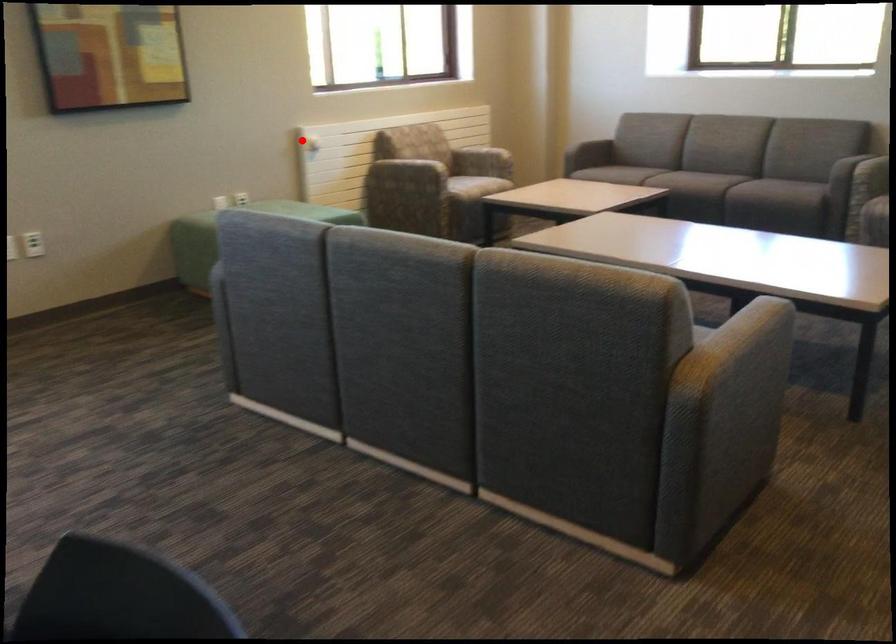
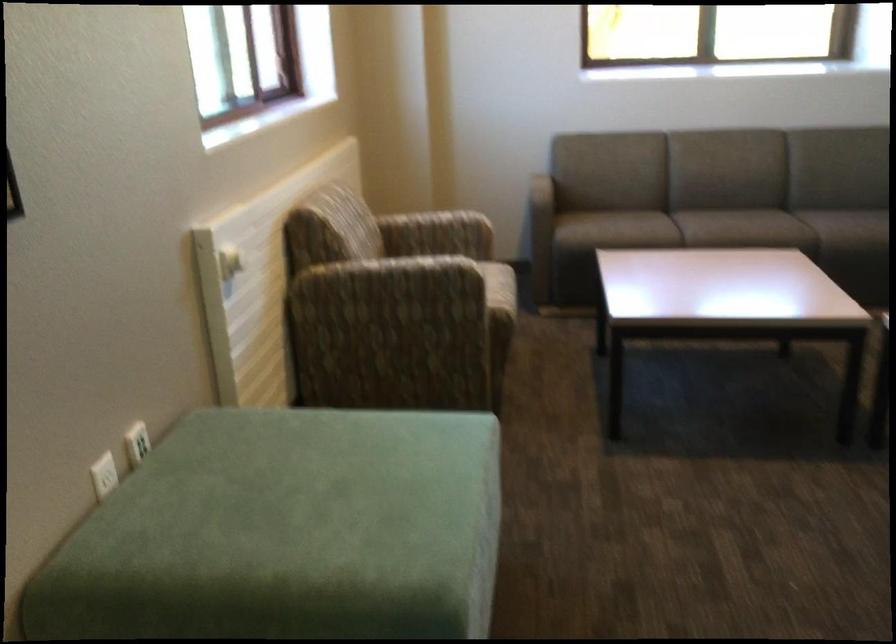
Question: I am providing you with two images of the same scene from different viewpoints. Given a red point in image1, look at the same physical point in image2. Is it:

Choices:
 (A) Closer to the viewpoint
 (B) Farther from the viewpoint

Answer: (A)